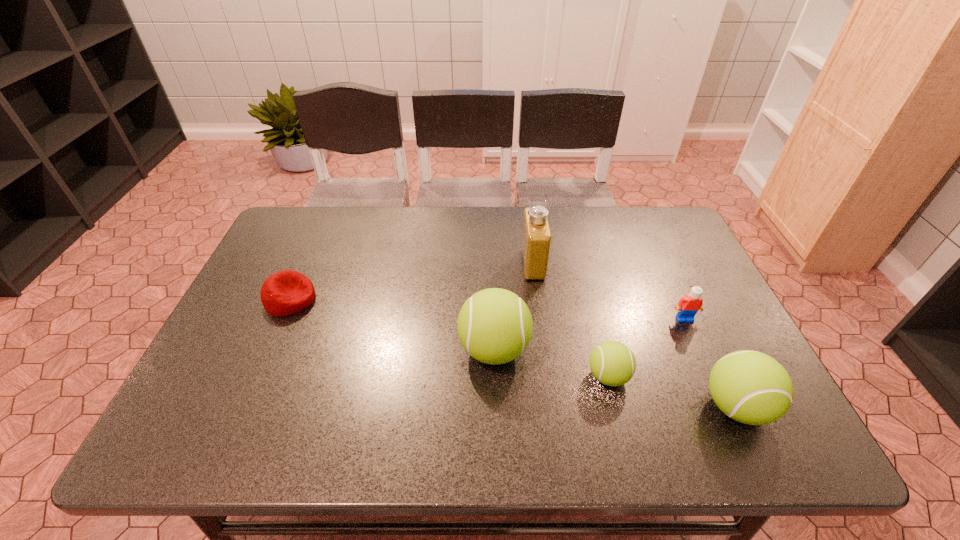
Locate an element on the screen. This screenshot has height=540, width=960. free region located on the right of the leftmost tennis ball is located at coordinates (657, 349).

Image resolution: width=960 pixels, height=540 pixels. I want to click on blank space located 0.280m on the right of the third object from right to left, so click(x=751, y=376).

Identify the location of free spot located 0.400m on the left of the second shortest tennis ball. (519, 407).

Locate an element on the screen. vacant space positioned 0.090m on the face of the Lego is located at coordinates (699, 350).

Where is `free location located on the front-facing side of the perfume`? The height and width of the screenshot is (540, 960). free location located on the front-facing side of the perfume is located at coordinates (442, 265).

Identify the location of vacant space located 0.340m on the front-facing side of the perfume. (x=408, y=265).

Identify the location of vacant area situated 0.360m on the front-facing side of the perfume. (401, 265).

The height and width of the screenshot is (540, 960). I want to click on vacant space located on the seat area of the leftmost object, so (373, 299).

Where is `object at the far edge`? This screenshot has height=540, width=960. object at the far edge is located at coordinates (536, 241).

What are the coordinates of `object located in the left edge section of the desktop` in the screenshot? It's located at click(x=287, y=292).